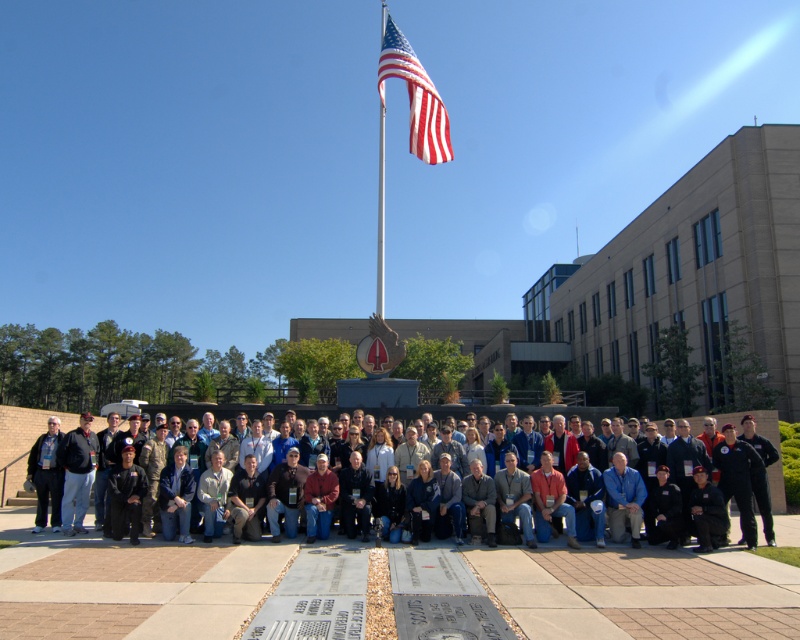
You are a photographer positioned to capture the scene. You need to frame both the dark blue uniform at center and the polished metal flag pole at upper center in the same shot. Which object should you adjust your camera angle to prioritize if you want to ensure both are fully visible without cropping?

The dark blue uniform at center is wider than the polished metal flag pole at upper center. To ensure both are fully visible, prioritize framing the dark blue uniform at center first since it requires more space in the composition.